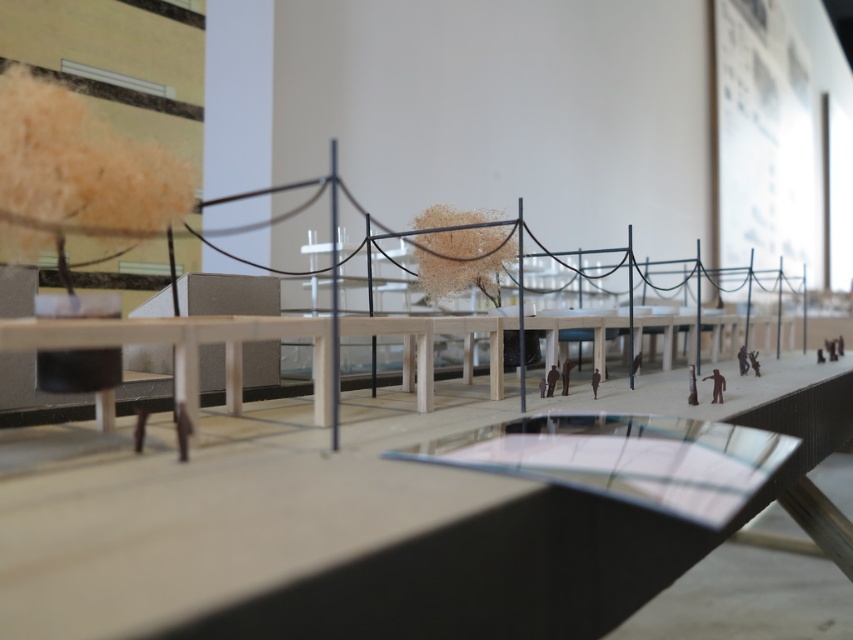
Question: Is brown matte figure at center-right thinner than dark brown wooden figure at center?

Choices:
 (A) yes
 (B) no

Answer: (B)

Question: Does brown matte figure at center-right have a larger size compared to brown matte figure at center?

Choices:
 (A) no
 (B) yes

Answer: (B)

Question: Which of the following is the closest to the observer?

Choices:
 (A) pyautogui.click(x=704, y=378)
 (B) pyautogui.click(x=593, y=387)
 (C) pyautogui.click(x=549, y=388)
 (D) pyautogui.click(x=746, y=358)

Answer: (B)

Question: Which point is closer to the camera taking this photo?

Choices:
 (A) (595, 372)
 (B) (712, 396)
 (C) (552, 381)

Answer: (B)

Question: Which is nearer to the dark brown fabric figure at center?

Choices:
 (A) dark brown wooden figure at center
 (B) brown matte figure at center

Answer: (B)

Question: Is dark brown wooden figure at center thinner than dark brown fabric figure at center?

Choices:
 (A) no
 (B) yes

Answer: (A)